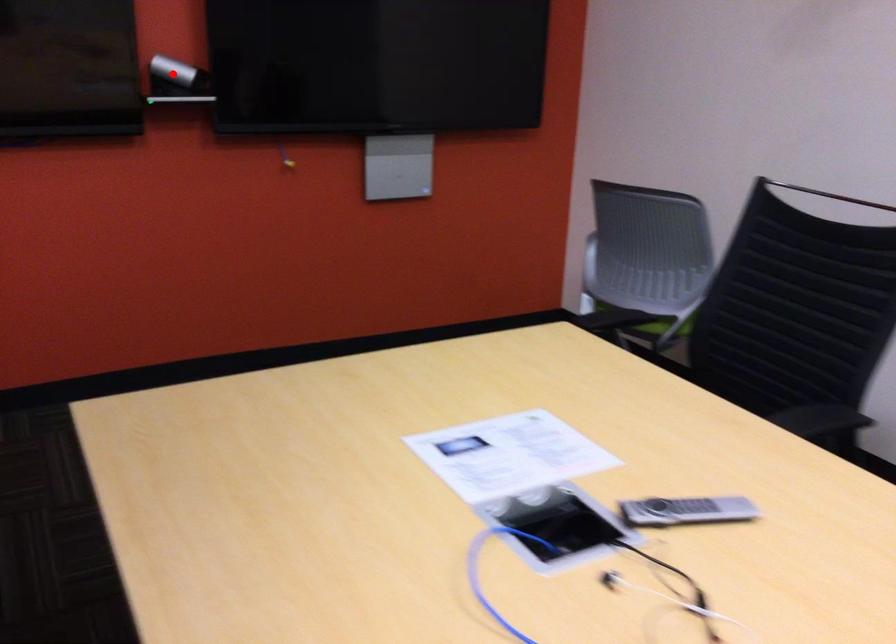
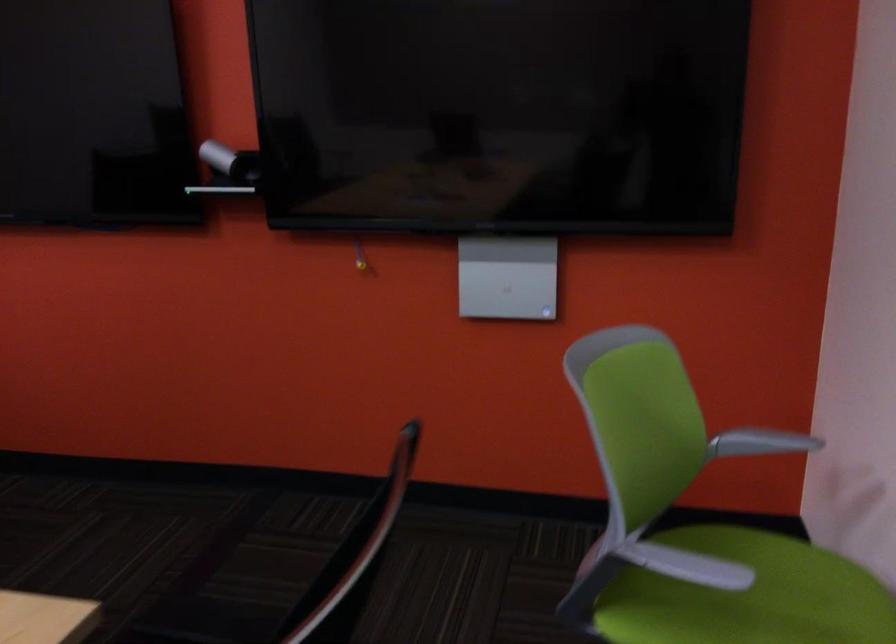
Locate, in the second image, the point that corresponds to the highlighted location in the first image.

(230, 162)